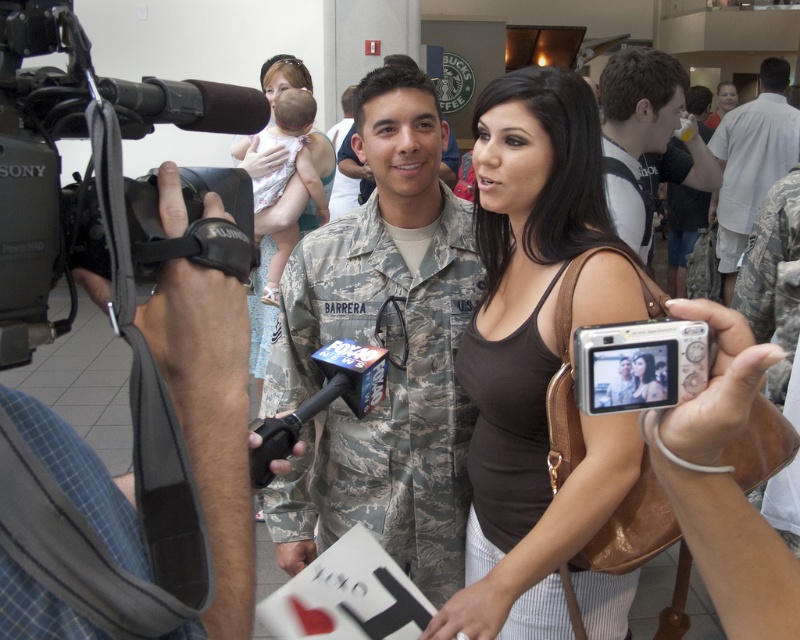
Question: Does black matte video camera at left have a larger size compared to white mesh shirt at upper right?

Choices:
 (A) yes
 (B) no

Answer: (B)

Question: Which point appears closest to the camera in this image?

Choices:
 (A) (328, 529)
 (B) (732, 90)
 (C) (22, 22)
 (D) (720, 209)

Answer: (C)

Question: Which point is closer to the camera taking this photo?

Choices:
 (A) (478, 490)
 (B) (718, 109)
 (C) (709, 188)
 (D) (649, 368)

Answer: (D)

Question: Can you confirm if white cotton shirt at center is positioned below matte brown hair at center?

Choices:
 (A) no
 (B) yes

Answer: (B)

Question: Can you confirm if camouflage fabric uniform at center is positioned above black matte video camera at left?

Choices:
 (A) no
 (B) yes

Answer: (A)

Question: Which object appears farthest from the camera in this image?

Choices:
 (A) black matte video camera at left
 (B) brown fabric tank top at center

Answer: (B)